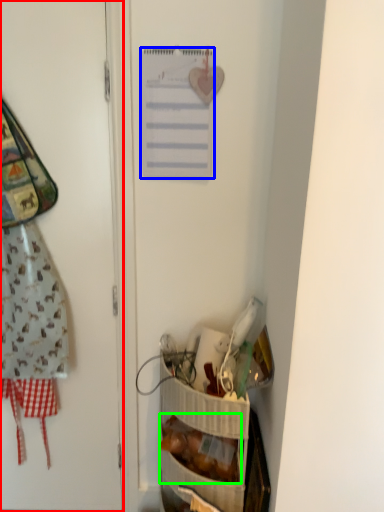
Question: Estimate the real-world distances between objects in this image. Which object is closer to door (highlighted by a red box), list (highlighted by a blue box) or food (highlighted by a green box)?

Choices:
 (A) list
 (B) food

Answer: (A)